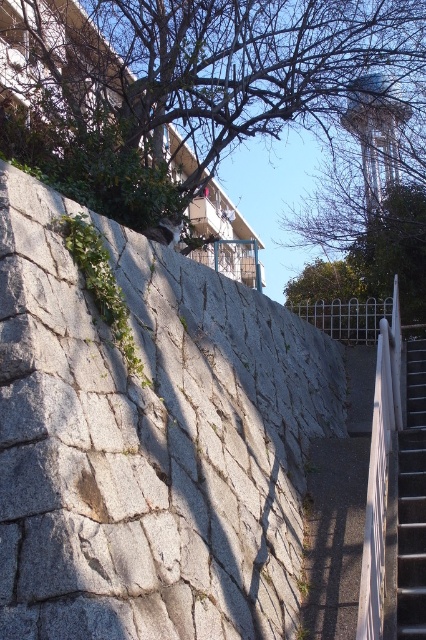
You are standing in a park and see the green leafy tree at upper center. If you want to walk towards it, how many steps would you need to take if each step covers 0.75 meters?

The distance between you and the green leafy tree at upper center is 23.22 meters. Dividing this by 0.75 meters per step gives approximately 30.96 steps. Since you can only take whole steps, you would need to take 31 steps to reach the tree.

You are a delivery robot with a 2.5 meter long package. You need to move from the gray granite wall at center to the metallic gray stair at lower right. Can you move the package without bending it?

The distance between the gray granite wall at center and the metallic gray stair at lower right is 3.96 meters, so the 2.5 meter long package can be moved without bending as the distance is sufficient.

You are a drone operator trying to map coordinates in the image. You need to determine which of the two points, point (172, 476) or point (420, 460), is nearer to the camera. Which one is closer?

Point (172, 476) is closer to the camera than point (420, 460).